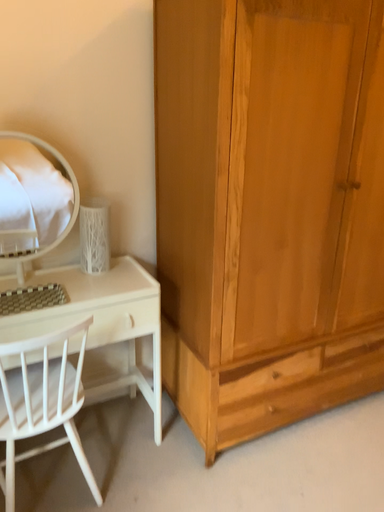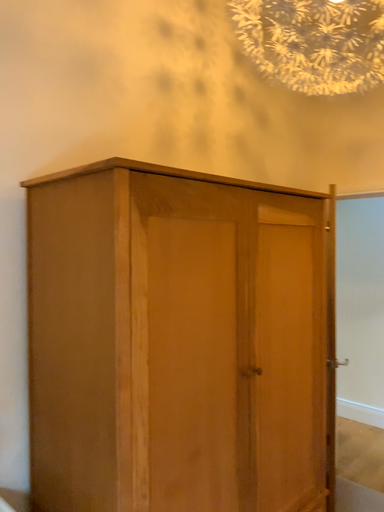
Question: How did the camera likely rotate when shooting the video?

Choices:
 (A) rotated left
 (B) rotated right

Answer: (B)